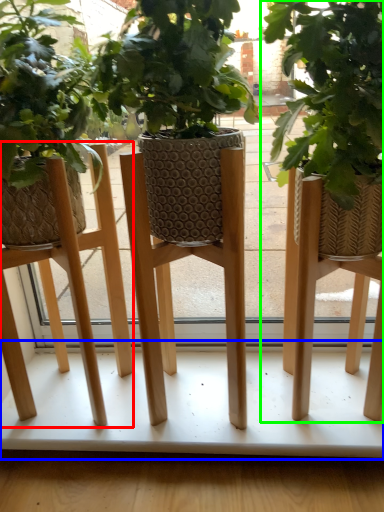
Question: Considering the real-world distances, which object is closest to stool (highlighted by a red box)? table (highlighted by a blue box) or houseplant (highlighted by a green box).

Choices:
 (A) table
 (B) houseplant

Answer: (A)